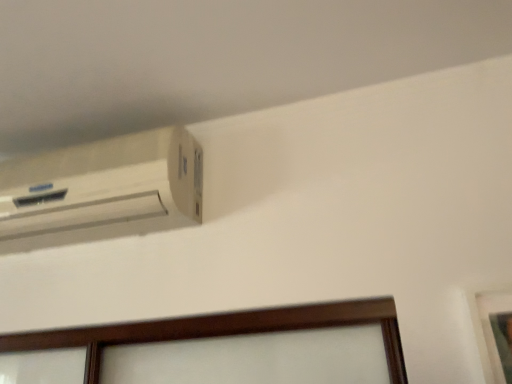
Question: From the image's perspective, would you say wooden picture frame at lower right is shown under white matte air conditioning at upper left?

Choices:
 (A) no
 (B) yes

Answer: (B)

Question: Considering the relative sizes of wooden picture frame at lower right and white matte air conditioning at upper left in the image provided, is wooden picture frame at lower right smaller than white matte air conditioning at upper left?

Choices:
 (A) no
 (B) yes

Answer: (B)

Question: Can you confirm if wooden picture frame at lower right is bigger than white matte air conditioning at upper left?

Choices:
 (A) no
 (B) yes

Answer: (A)

Question: From a real-world perspective, is wooden picture frame at lower right positioned under white matte air conditioning at upper left based on gravity?

Choices:
 (A) no
 (B) yes

Answer: (B)

Question: Is wooden picture frame at lower right touching white matte air conditioning at upper left?

Choices:
 (A) yes
 (B) no

Answer: (B)

Question: Does wooden picture frame at lower right contain white matte air conditioning at upper left?

Choices:
 (A) no
 (B) yes

Answer: (A)

Question: Is white matte air conditioning at upper left taller than wooden picture frame at lower right?

Choices:
 (A) yes
 (B) no

Answer: (B)

Question: Is white matte air conditioning at upper left smaller than wooden picture frame at lower right?

Choices:
 (A) yes
 (B) no

Answer: (B)

Question: Does white matte air conditioning at upper left come in front of wooden picture frame at lower right?

Choices:
 (A) yes
 (B) no

Answer: (B)

Question: Could wooden picture frame at lower right be considered to be inside white matte air conditioning at upper left?

Choices:
 (A) yes
 (B) no

Answer: (B)

Question: Is white matte air conditioning at upper left not close to wooden picture frame at lower right?

Choices:
 (A) yes
 (B) no

Answer: (B)

Question: From the image's perspective, is white matte air conditioning at upper left on wooden picture frame at lower right?

Choices:
 (A) yes
 (B) no

Answer: (A)

Question: Considering the positions of point coord(502,375) and point coord(146,155), is point coord(502,375) closer or farther from the camera than point coord(146,155)?

Choices:
 (A) closer
 (B) farther

Answer: (A)